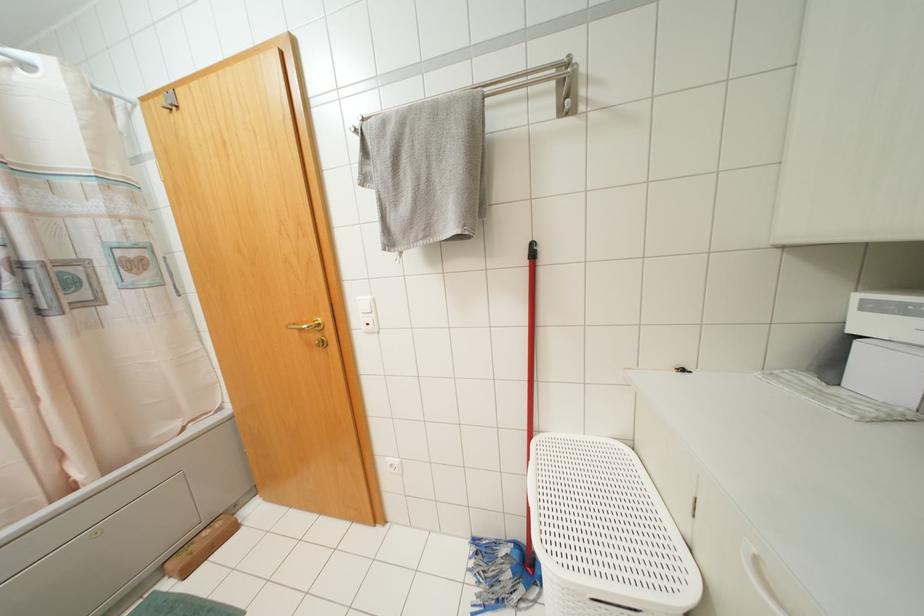
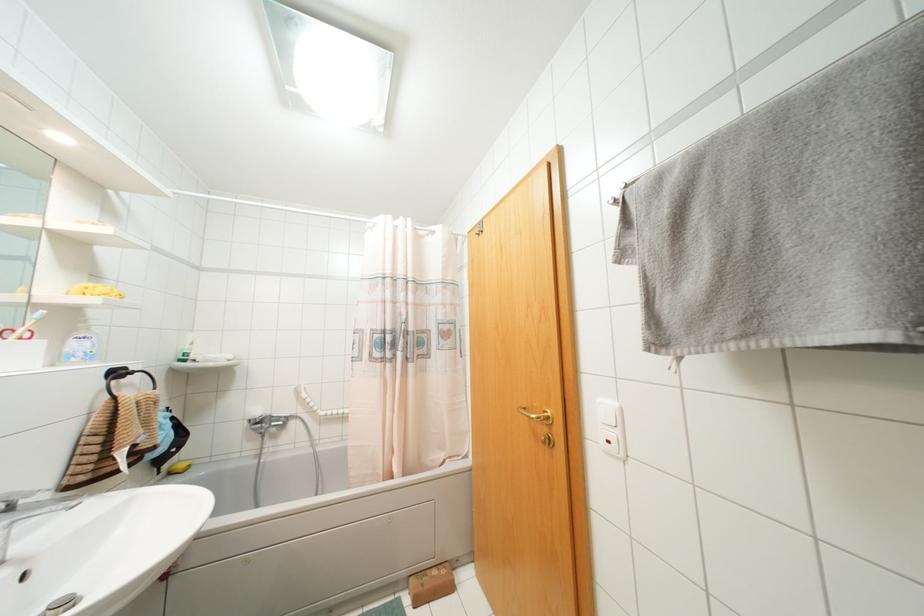
Where in the second image is the point corresponding to (319,323) from the first image?

(546, 416)